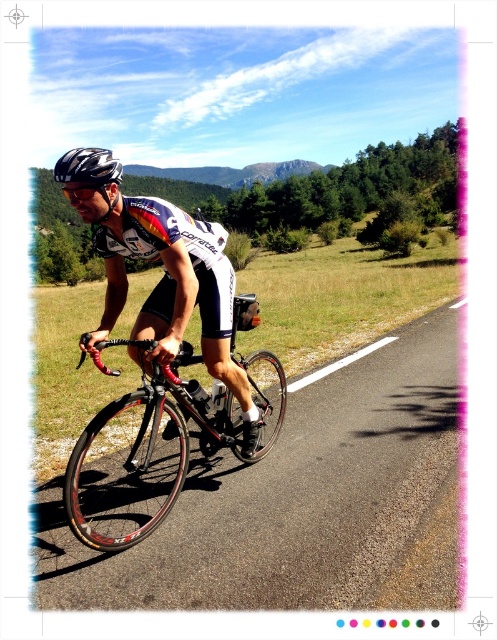
Is shiny black frame at center below black matte bicycle helmet at upper left?

Indeed, shiny black frame at center is positioned under black matte bicycle helmet at upper left.

Who is higher up, shiny black frame at center or black matte bicycle helmet at upper left?

black matte bicycle helmet at upper left is above.

You are a GUI agent. You are given a task and a screenshot of the screen. Output one action in this format:
    pyautogui.click(x=<x>, y=<y>)
    Task: Click on the shiny black frame at center
    Image resolution: width=497 pixels, height=640 pixels.
    Given the screenshot: What is the action you would take?
    coord(167,436)

Find the location of a particular element. shiny black frame at center is located at coordinates (167, 436).

Between matte black bicycle at center and shiny black frame at center, which one is positioned lower?

shiny black frame at center is lower down.

Does matte black bicycle at center appear on the left side of shiny black frame at center?

Yes, matte black bicycle at center is to the left of shiny black frame at center.

Describe the element at coordinates (167, 284) in the screenshot. I see `matte black bicycle at center` at that location.

At what (x,y) coordinates should I click in order to perform the action: click on matte black bicycle at center. Please return your answer as a coordinate pair (x, y). This screenshot has height=640, width=497. Looking at the image, I should click on (167, 284).

Which is in front, point (202, 296) or point (58, 170)?

Point (58, 170) is in front.

Does point (215, 328) lie behind point (80, 161)?

Yes.

Does point (160, 328) come in front of point (103, 154)?

No, (160, 328) is further to viewer.

Locate an element on the screen. matte black bicycle at center is located at coordinates (167, 284).